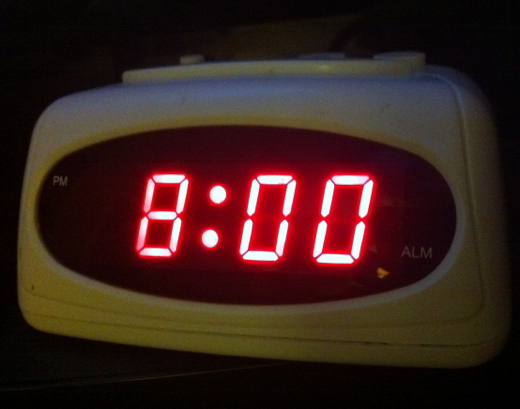
Locate an element on the screen. Image resolution: width=520 pixels, height=409 pixels. front of clock is located at coordinates (209, 320).